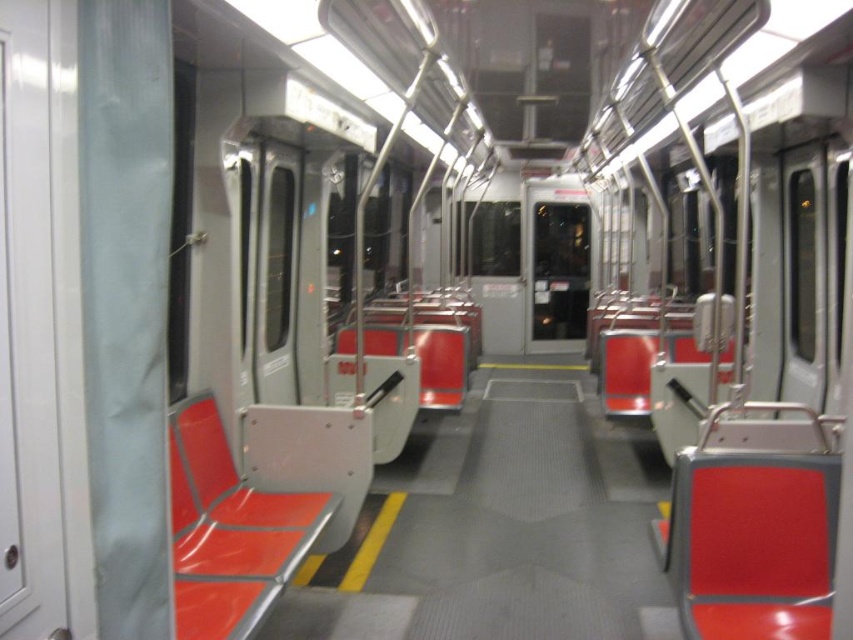
Question: Is matte red seat at center to the left of metallic red seat at center from the viewer's perspective?

Choices:
 (A) yes
 (B) no

Answer: (B)

Question: Which object is farther from the camera taking this photo?

Choices:
 (A) metallic red seat at center
 (B) matte red seat at center

Answer: (A)

Question: Can you confirm if matte red seat at center is positioned above metallic red seat at center?

Choices:
 (A) yes
 (B) no

Answer: (A)

Question: Can you confirm if matte red seat at center is wider than metallic red seat at center?

Choices:
 (A) yes
 (B) no

Answer: (A)

Question: Which point is closer to the camera?

Choices:
 (A) click(773, 586)
 (B) click(204, 611)

Answer: (B)